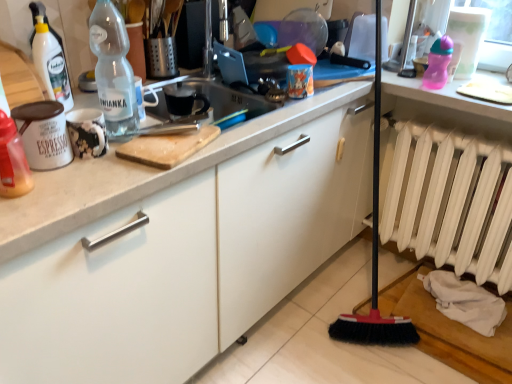
Question: Does translucent plastic bottle at left, which is the 1th bottle from left to right, have a greater height compared to white matte radiator at lower right?

Choices:
 (A) no
 (B) yes

Answer: (A)

Question: Is translucent plastic bottle at left, arranged as the 2th bottle when viewed from the right, outside white matte radiator at lower right?

Choices:
 (A) yes
 (B) no

Answer: (A)

Question: Does translucent plastic bottle at left, which is the 1th bottle from left to right, have a larger size compared to white matte radiator at lower right?

Choices:
 (A) no
 (B) yes

Answer: (A)

Question: Is white matte radiator at lower right a part of translucent plastic bottle at left, which appears as the 2th bottle when viewed from the back?

Choices:
 (A) no
 (B) yes

Answer: (A)

Question: Does translucent plastic bottle at left, the first bottle when ordered from front to back, have a lesser height compared to white matte radiator at lower right?

Choices:
 (A) yes
 (B) no

Answer: (A)

Question: In terms of height, does translucent plastic bottle at left, the first bottle when ordered from front to back, look taller or shorter compared to transparent plastic bottle at upper left, the 2th bottle positioned from the front?

Choices:
 (A) short
 (B) tall

Answer: (A)

Question: From a real-world perspective, is translucent plastic bottle at left, acting as the second bottle starting from the top, physically located above or below transparent plastic bottle at upper left, positioned as the 2th bottle in bottom-to-top order?

Choices:
 (A) below
 (B) above

Answer: (A)

Question: Considering their positions, is translucent plastic bottle at left, acting as the second bottle starting from the top, located in front of or behind transparent plastic bottle at upper left, arranged as the second bottle when viewed from the left?

Choices:
 (A) behind
 (B) front

Answer: (B)

Question: In terms of width, does translucent plastic bottle at left, arranged as the 2th bottle when viewed from the right, look wider or thinner when compared to transparent plastic bottle at upper left, which is the 1th bottle in top-to-bottom order?

Choices:
 (A) wide
 (B) thin

Answer: (B)

Question: Is white matte radiator at lower right spatially inside translucent plastic bottle at left, the first bottle ordered from the bottom, or outside of it?

Choices:
 (A) outside
 (B) inside

Answer: (A)

Question: From the image's perspective, relative to translucent plastic bottle at left, the first bottle when ordered from front to back, is white matte radiator at lower right above or below?

Choices:
 (A) below
 (B) above

Answer: (A)

Question: Is white matte radiator at lower right in front of or behind translucent plastic bottle at left, the first bottle ordered from the bottom, in the image?

Choices:
 (A) behind
 (B) front

Answer: (A)

Question: In terms of width, does white matte radiator at lower right look wider or thinner when compared to translucent plastic bottle at left, arranged as the 2th bottle when viewed from the right?

Choices:
 (A) wide
 (B) thin

Answer: (A)

Question: From the image's perspective, is transparent plastic bottle at upper left, positioned as the 2th bottle in bottom-to-top order, above or below white matte radiator at lower right?

Choices:
 (A) below
 (B) above

Answer: (B)

Question: In the image, is transparent plastic bottle at upper left, the 2th bottle positioned from the front, on the left side or the right side of white matte radiator at lower right?

Choices:
 (A) right
 (B) left

Answer: (B)